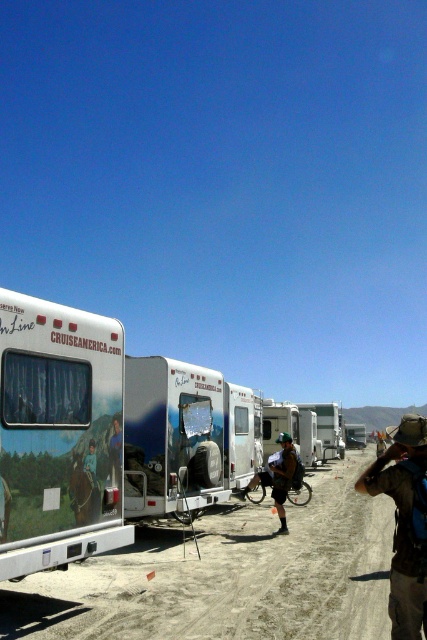
You are a photographer at the campground and want to capture both the brown fabric hat at lower right and the green fabric shirt at center in a single shot. Given their sizes, which object should you focus on first to ensure both are in frame?

The brown fabric hat at lower right is larger than the green fabric shirt at center, so you should focus on the brown fabric hat at lower right first to ensure both are in frame.

You are a photographer standing at the edge of the RV parking area. You want to take a photo that includes both the brown fabric hat at lower right and the green fabric shirt at center. Which object should you adjust your camera angle to include first if you need to frame both in the shot?

The brown fabric hat at lower right is positioned on the right side of the green fabric shirt at center. To include both in the frame, you should adjust your camera angle to first ensure the brown fabric hat at lower right is within the shot, as it is located farther to the right compared to the green fabric shirt at center.